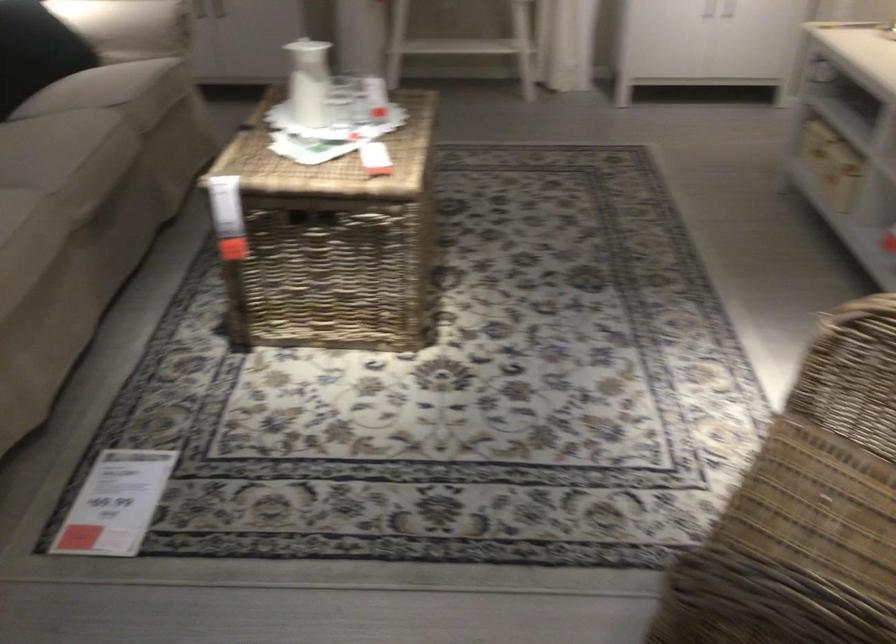
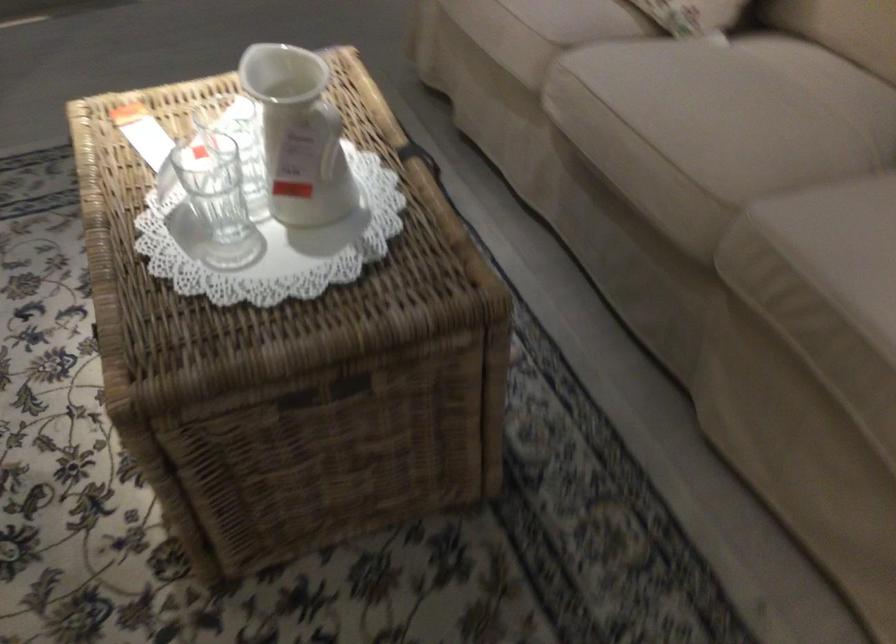
The point at (303, 70) is marked in the first image. Where is the corresponding point in the second image?

(328, 137)